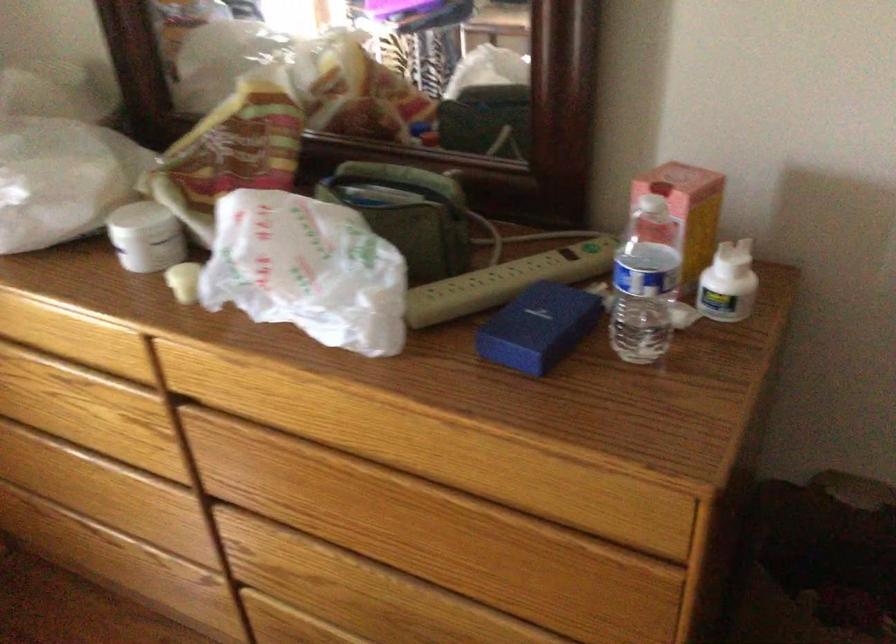
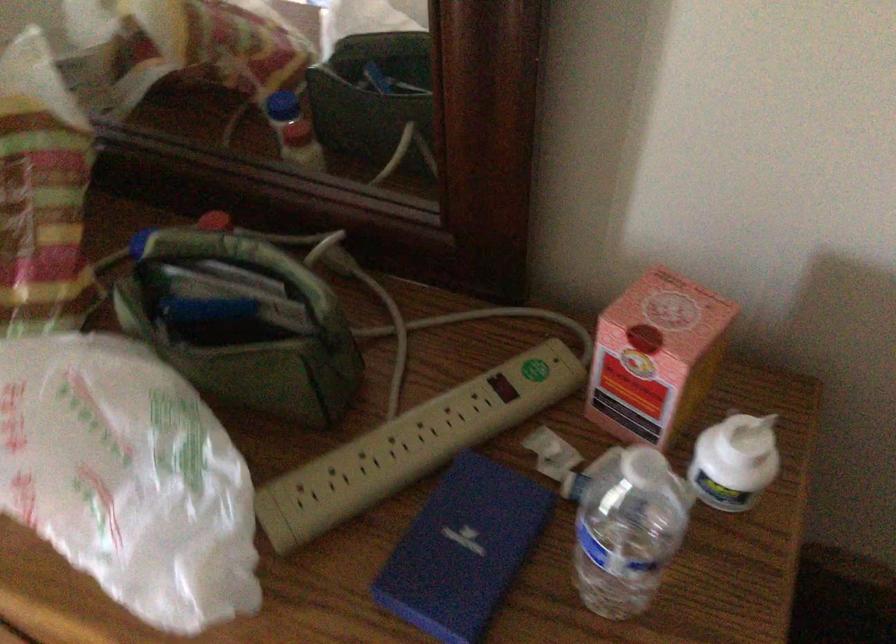
In the second image, find the point that corresponds to point 566,252 in the first image.

(503, 386)